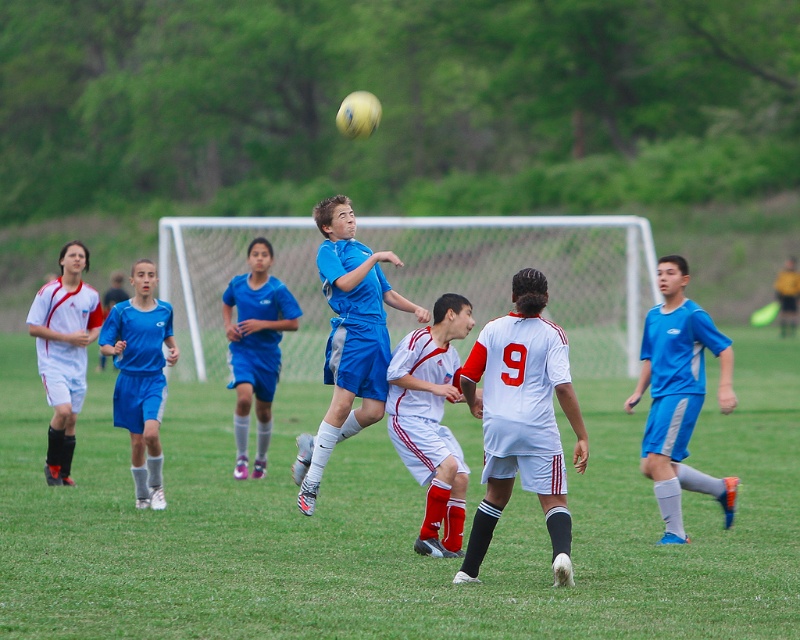
Consider the image. You are a referee observing the soccer match and need to determine if the blue fabric soccer jersey at center is smaller than the white matte soccer player at center. Based on the scene provided, can you confirm this?

Yes, the blue fabric soccer jersey at center has a smaller size compared to the white matte soccer player at center according to the description.

You are a soccer coach analyzing the players during a match. You notice the blue fabric soccer jersey at center and the matte blue shorts at center. Which piece of clothing has a wider width?

The matte blue shorts at center has a wider width than the blue fabric soccer jersey at center according to the description.

From the picture: You are a referee observing the soccer match. You notice two players wearing blue jerseys. One is the blue fabric soccer jersey at center and the other is the matte blue jersey at left. Which player is positioned to the right of the other?

The blue fabric soccer jersey at center is positioned to the right of the matte blue jersey at left.